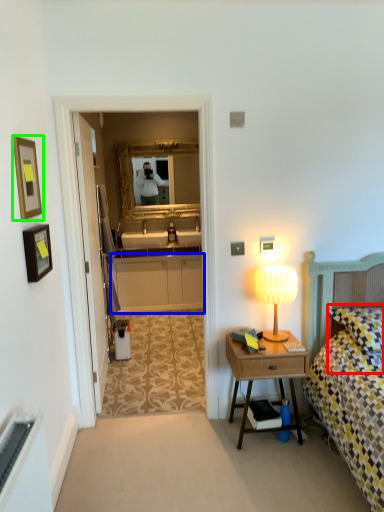
Question: Which object is the closest to the pillow (highlighted by a red box)? Choose among these: cabinetry (highlighted by a blue box) or picture frame (highlighted by a green box).

Choices:
 (A) cabinetry
 (B) picture frame

Answer: (B)